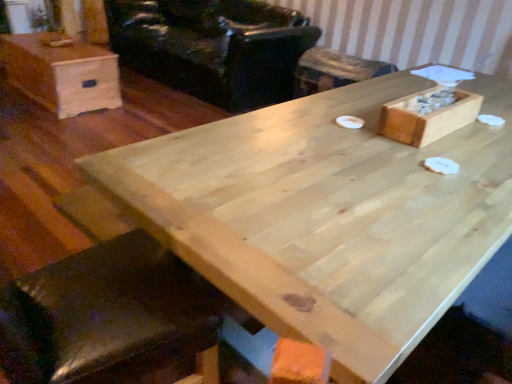
This screenshot has width=512, height=384. What are the coordinates of `blank space to the left of wooden box at upper right` in the screenshot? It's located at (336, 123).